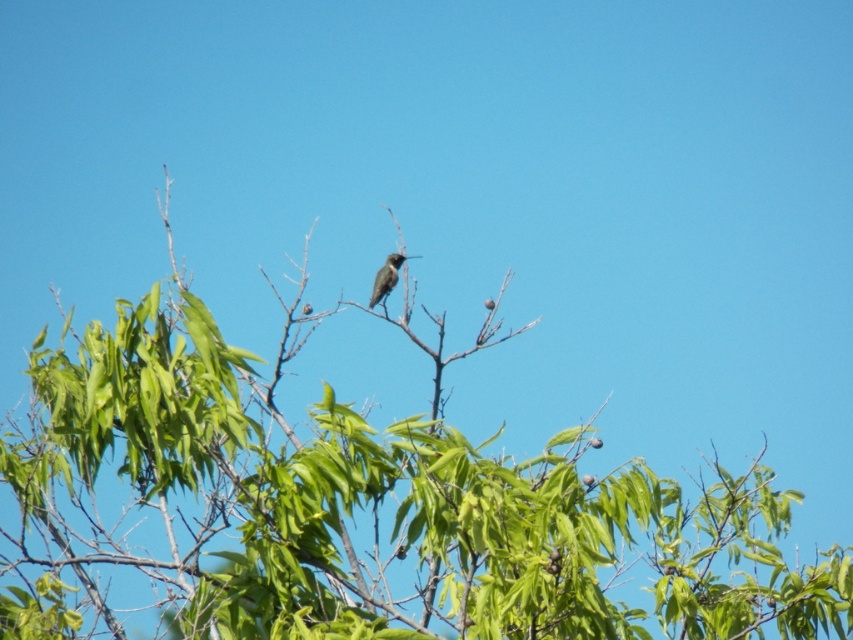
Question: Which of the following is the closest to the observer?

Choices:
 (A) (381, 289)
 (B) (606, 595)

Answer: (A)

Question: Is green leafy tree at center above shiny brown bird at center?

Choices:
 (A) no
 (B) yes

Answer: (A)

Question: Where is green leafy tree at center located in relation to shiny brown bird at center in the image?

Choices:
 (A) left
 (B) right

Answer: (B)

Question: Which point is closer to the camera?

Choices:
 (A) coord(383,294)
 (B) coord(241,636)

Answer: (B)

Question: Does green leafy tree at center appear over shiny brown bird at center?

Choices:
 (A) yes
 (B) no

Answer: (B)